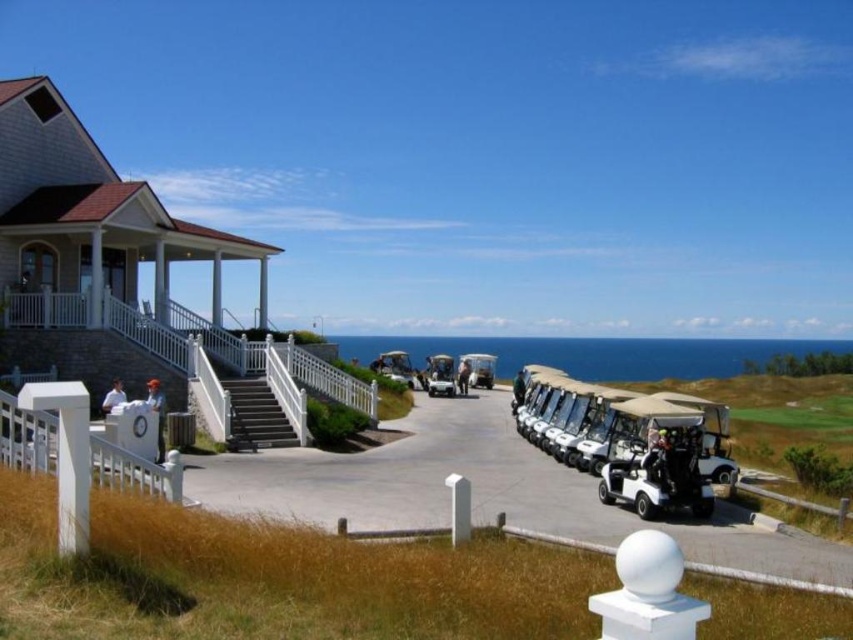
Question: Is smooth concrete stairs at center closer to camera compared to matte black golf cart at center?

Choices:
 (A) yes
 (B) no

Answer: (A)

Question: Which point is closer to the camera?

Choices:
 (A) (274, 362)
 (B) (445, 378)

Answer: (A)

Question: Which point is closer to the camera?

Choices:
 (A) (474, 358)
 (B) (614, 380)
 (C) (450, 385)
 (D) (398, 368)

Answer: (C)

Question: Which of the following is the farthest from the observer?

Choices:
 (A) (286, 348)
 (B) (595, 339)

Answer: (B)

Question: Is white matte golf cart at center to the right of matte black golf cart at center from the viewer's perspective?

Choices:
 (A) no
 (B) yes

Answer: (B)

Question: Is white painted wood porch at left bigger than blue water at center?

Choices:
 (A) yes
 (B) no

Answer: (B)